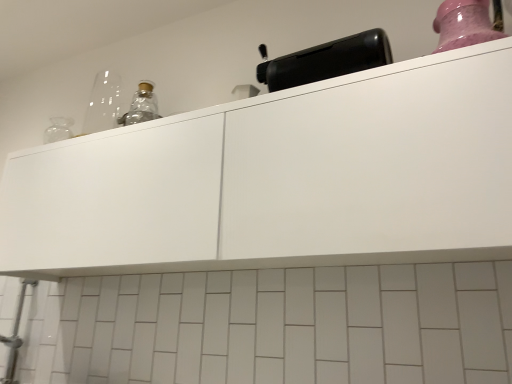
Question: Does pink glossy jar at upper right have a lesser height compared to white matte cabinet at upper center?

Choices:
 (A) yes
 (B) no

Answer: (A)

Question: Considering the relative positions of pink glossy jar at upper right and white matte cabinet at upper center in the image provided, is pink glossy jar at upper right to the right of white matte cabinet at upper center from the viewer's perspective?

Choices:
 (A) yes
 (B) no

Answer: (A)

Question: Is pink glossy jar at upper right oriented towards white matte cabinet at upper center?

Choices:
 (A) yes
 (B) no

Answer: (B)

Question: Considering the relative sizes of pink glossy jar at upper right and white matte cabinet at upper center in the image provided, is pink glossy jar at upper right smaller than white matte cabinet at upper center?

Choices:
 (A) no
 (B) yes

Answer: (B)

Question: From a real-world perspective, is pink glossy jar at upper right positioned under white matte cabinet at upper center based on gravity?

Choices:
 (A) no
 (B) yes

Answer: (A)

Question: Is pink glossy jar at upper right thinner than white matte cabinet at upper center?

Choices:
 (A) no
 (B) yes

Answer: (B)

Question: Can you confirm if white matte cabinet at upper center is smaller than pink glossy jar at upper right?

Choices:
 (A) no
 (B) yes

Answer: (A)

Question: Does white matte cabinet at upper center have a lesser width compared to pink glossy jar at upper right?

Choices:
 (A) no
 (B) yes

Answer: (A)

Question: Could you tell me if white matte cabinet at upper center is facing pink glossy jar at upper right?

Choices:
 (A) yes
 (B) no

Answer: (B)

Question: Would you consider white matte cabinet at upper center to be distant from pink glossy jar at upper right?

Choices:
 (A) yes
 (B) no

Answer: (B)

Question: From a real-world perspective, is white matte cabinet at upper center under pink glossy jar at upper right?

Choices:
 (A) no
 (B) yes

Answer: (B)

Question: From the image's perspective, is white matte cabinet at upper center under pink glossy jar at upper right?

Choices:
 (A) yes
 (B) no

Answer: (A)

Question: From the image's perspective, does black plastic toaster at upper center appear higher than pink glossy jar at upper right?

Choices:
 (A) no
 (B) yes

Answer: (A)